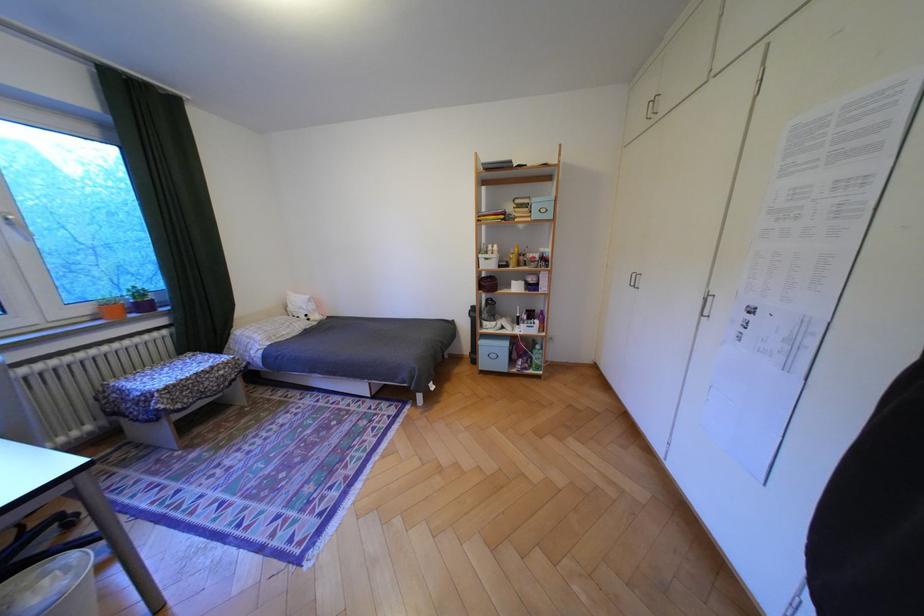
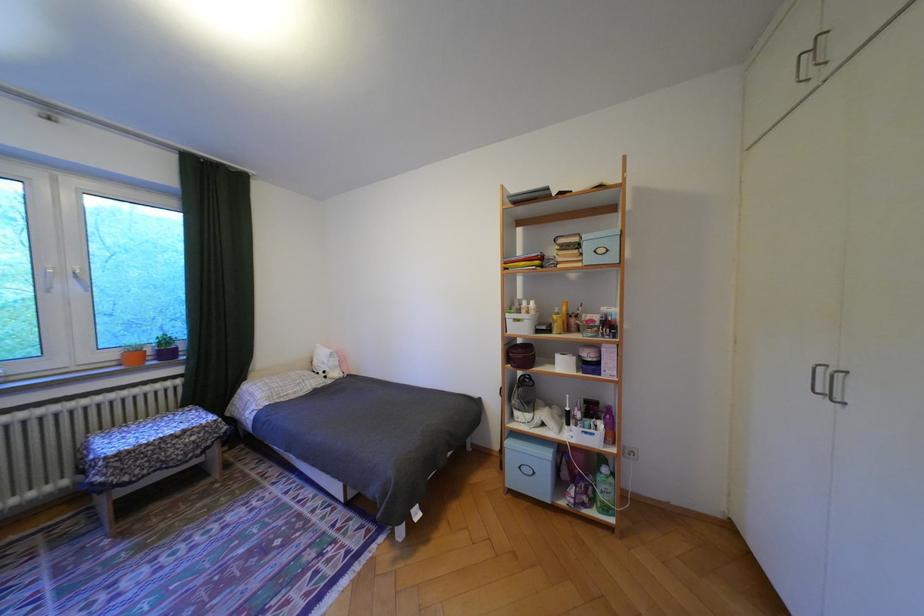
Locate, in the second image, the point that corresponds to [499,284] in the first image.

(531, 355)